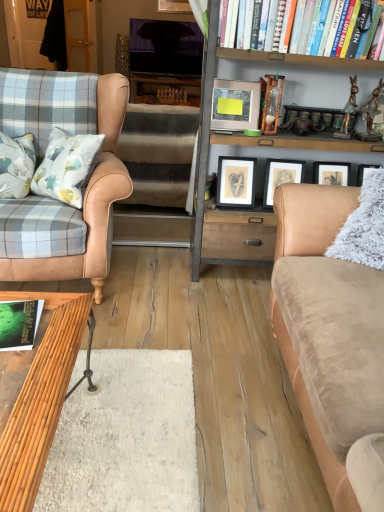
I want to click on free space above bamboo wood coffee table at lower left (from a real-world perspective), so click(31, 357).